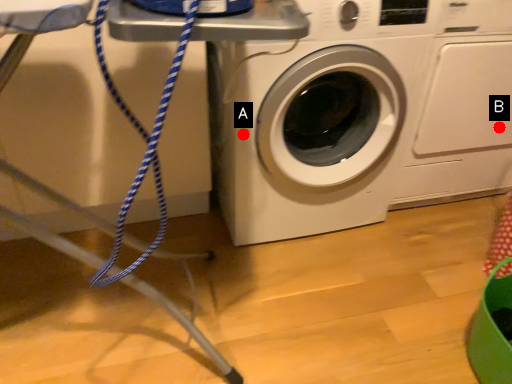
Question: Two points are circled on the image, labeled by A and B beside each circle. Which point is farther to the camera?

Choices:
 (A) A is further
 (B) B is further

Answer: (B)